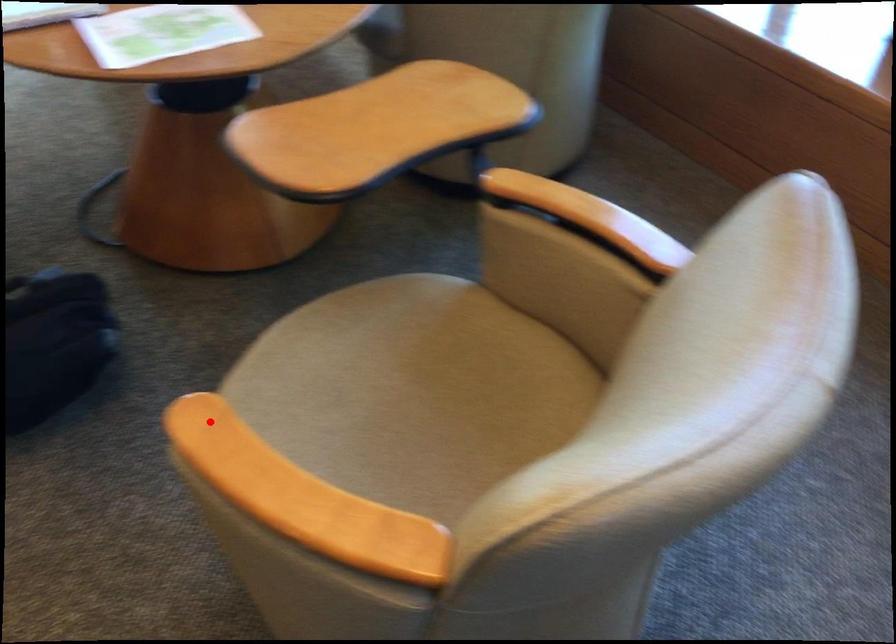
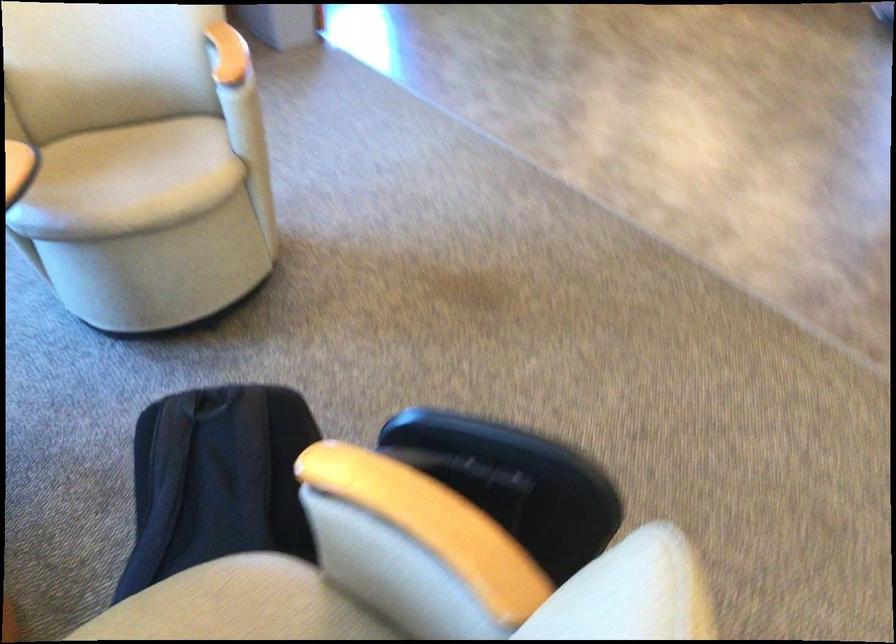
Question: I am providing you with two images of the same scene from different viewpoints. Given a red point in image1, look at the same physical point in image2. Is it:

Choices:
 (A) Closer to the viewpoint
 (B) Farther from the viewpoint

Answer: (B)